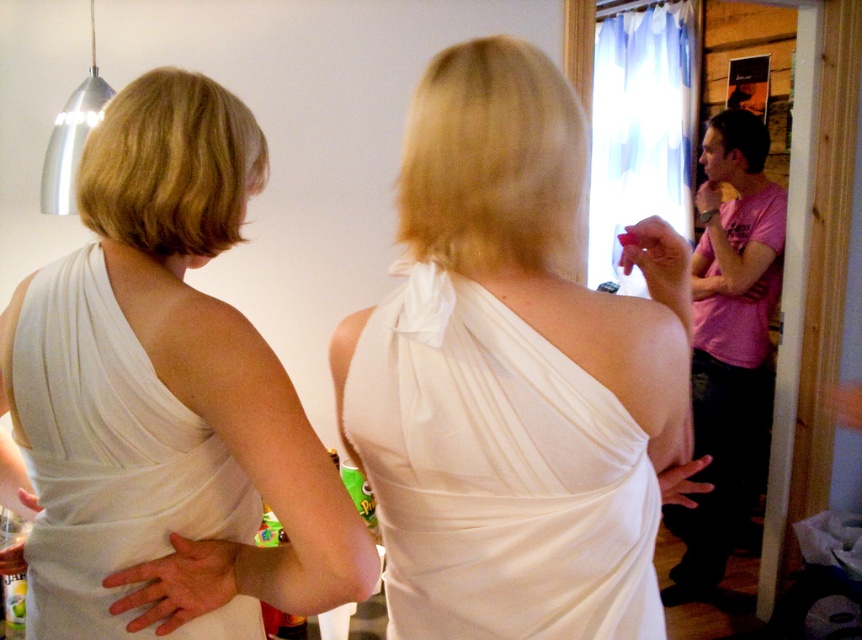
Question: Does white satin dress at center have a smaller size compared to white fabric dress at back?

Choices:
 (A) no
 (B) yes

Answer: (A)

Question: From the image, what is the correct spatial relationship of white satin dress at center in relation to white fabric dress at back?

Choices:
 (A) above
 (B) below

Answer: (A)

Question: Which object is closer to the camera taking this photo?

Choices:
 (A) white satin dress at center
 (B) white fabric dress at back

Answer: (A)

Question: Which point appears closest to the camera in this image?

Choices:
 (A) (222, 444)
 (B) (358, 444)
 (C) (300, 410)

Answer: (C)

Question: Among these points, which one is nearest to the camera?

Choices:
 (A) (659, 403)
 (B) (84, 378)
 (C) (123, 250)

Answer: (A)

Question: Is white fabric dress at upper left to the right of white fabric dress at back from the viewer's perspective?

Choices:
 (A) yes
 (B) no

Answer: (A)